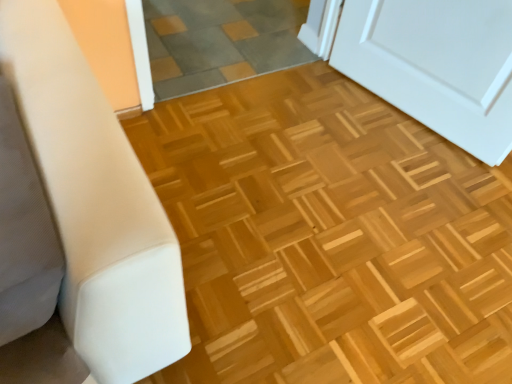
Describe the element at coordinates (220, 41) in the screenshot. This screenshot has width=512, height=384. I see `matte gray tile at upper center` at that location.

At what (x,y) coordinates should I click in order to perform the action: click on matte gray tile at upper center. Please return your answer as a coordinate pair (x, y). This screenshot has height=384, width=512. Looking at the image, I should click on (220, 41).

What is the approximate width of matte gray tile at upper center?

matte gray tile at upper center is 31.82 inches in width.

The width and height of the screenshot is (512, 384). In order to click on matte gray tile at upper center in this screenshot , I will do `click(220, 41)`.